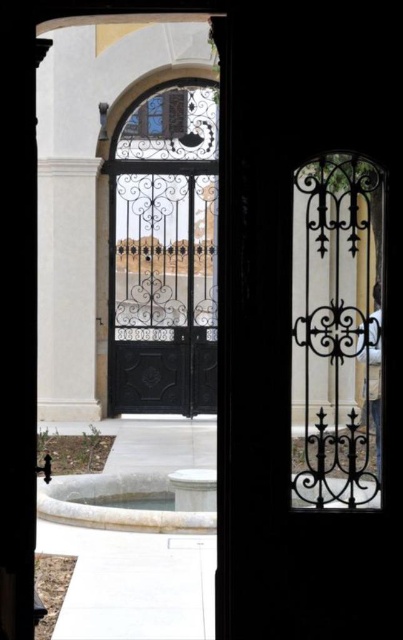
You are a visitor standing at the entrance of the courtyard. You notice the black wrought iron gate at center and the white marble fountain at lower center. Which object is taller?

The black wrought iron gate at center is taller than the white marble fountain at lower center.

Based on the photo, you are standing in the courtyard and want to take a photo of both point (145,275) and point (189,522) in the scene. Which point should you focus on first to ensure both are in sharp focus?

Focus on point (145,275) first because it is closer to the camera than point (189,522). By focusing on the closer object, the farther one will also be in focus due to depth of field.